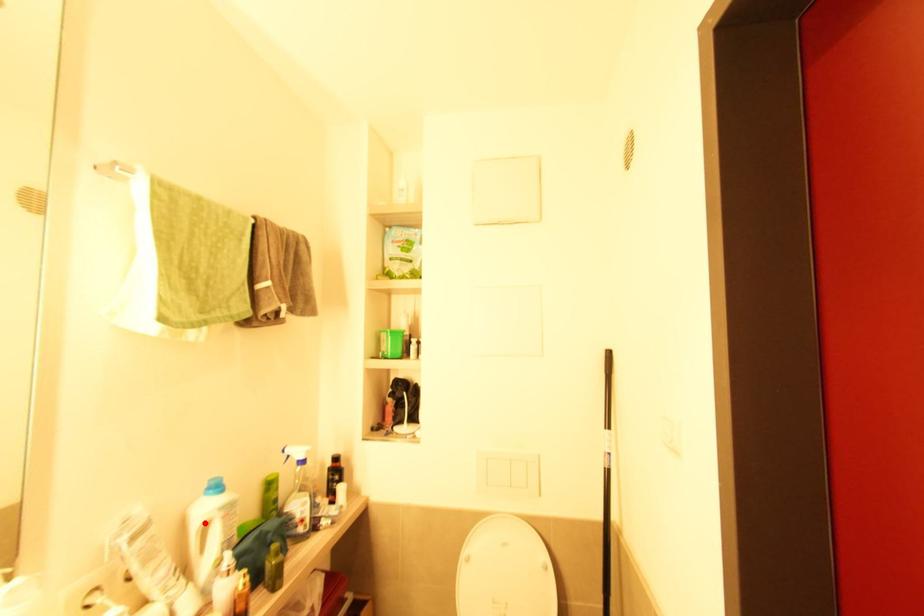
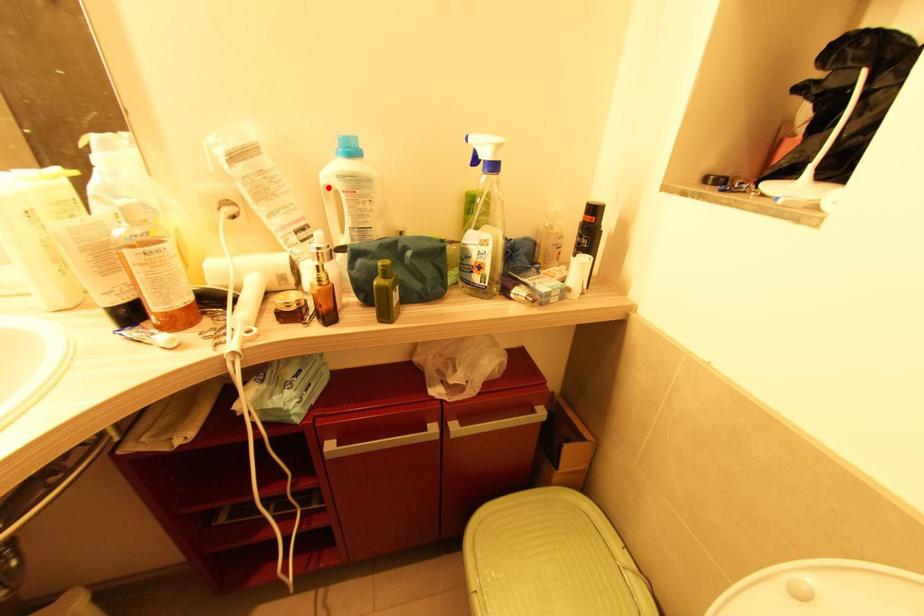
I am providing you with two images of the same scene from different viewpoints. A red point is marked on the first image and another point is marked on the second image. Does the point marked in image1 correspond to the same location as the one in image2?

Yes